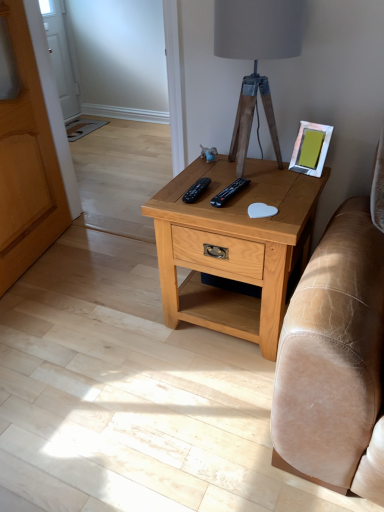
Where is `space that is in front of wooden tripod lamp at center`? This screenshot has height=512, width=384. space that is in front of wooden tripod lamp at center is located at coordinates (263, 194).